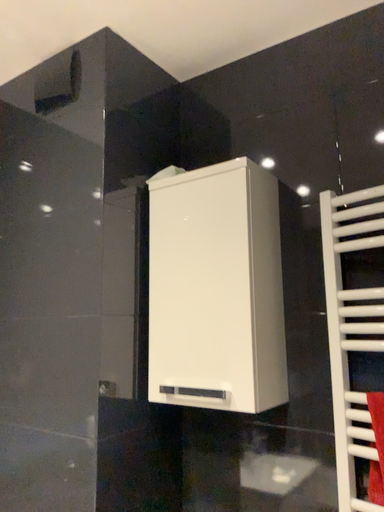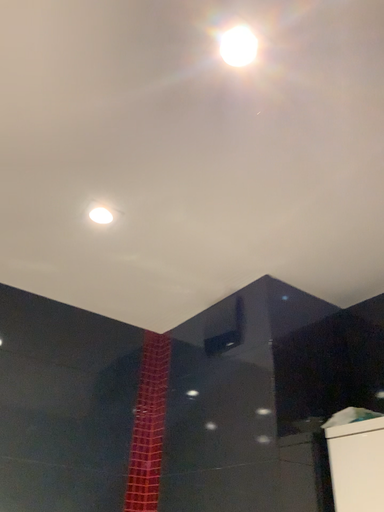
Question: Which way did the camera rotate in the video?

Choices:
 (A) rotated right
 (B) rotated left

Answer: (B)